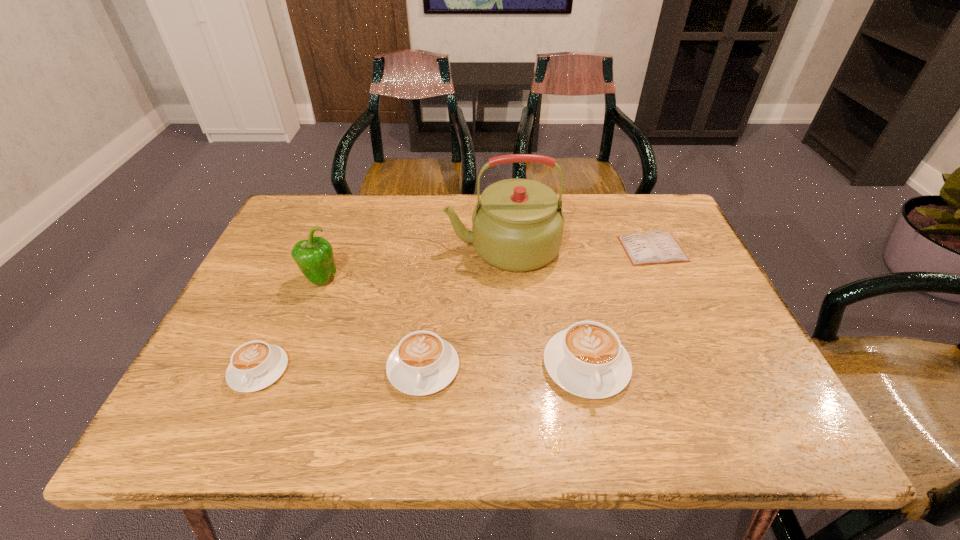
Identify the location of the leftmost cappuccino. This screenshot has width=960, height=540. (255, 365).

Find the location of a particular element. The height and width of the screenshot is (540, 960). the second shortest object is located at coordinates (255, 365).

Identify the location of the second cappuccino from left to right. (423, 363).

Find the location of `the third shortest object`. the third shortest object is located at coordinates (423, 363).

Where is `the third tallest object`? the third tallest object is located at coordinates (587, 359).

Find the location of a particular element. the rightmost cappuccino is located at coordinates (587, 359).

What are the coordinates of `kettle` in the screenshot? It's located at (517, 225).

You are a GUI agent. You are given a task and a screenshot of the screen. Output one action in this format:
    pyautogui.click(x=<x>, y=<y>)
    Task: Click on the second tallest object
    The height and width of the screenshot is (540, 960).
    Given the screenshot: What is the action you would take?
    pyautogui.click(x=314, y=257)

Identify the location of diary. (656, 247).

Find the location of a particular element. This screenshot has height=540, width=960. the rightmost object is located at coordinates (656, 247).